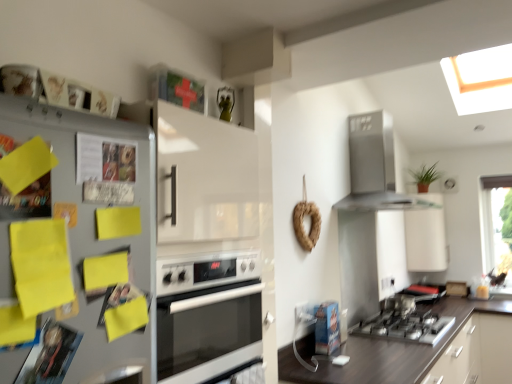
Question: Based on their sizes in the image, would you say green leafy plant at upper right is bigger or smaller than metallic gray refrigerator at left?

Choices:
 (A) big
 (B) small

Answer: (A)

Question: From a real-world perspective, is green leafy plant at upper right positioned above or below metallic gray refrigerator at left?

Choices:
 (A) above
 (B) below

Answer: (A)

Question: Which object is positioned closest to the white glossy oven at center?

Choices:
 (A) dark brown wood at lower right
 (B) green leafy plant at upper right
 (C) satin silver range hood at upper right
 (D) satin silver gas stove at lower center
 (E) white glossy cabinet at upper right

Answer: (A)

Question: Based on their relative distances, which object is nearer to the white glossy cabinet at upper right?

Choices:
 (A) green leafy plant at upper right
 (B) transparent glass window at upper right
 (C) satin silver gas stove at lower center
 (D) metallic gray refrigerator at left
 (E) white glossy oven at center

Answer: (A)